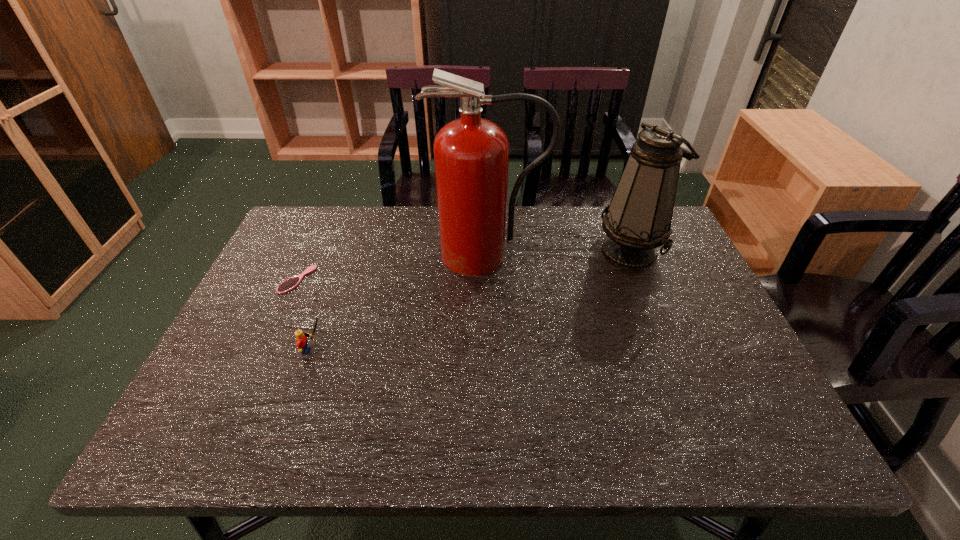
The image size is (960, 540). I want to click on vacant space located on the front-facing side of the Lego, so click(373, 350).

I want to click on free space located on the right of the shortest object, so click(458, 280).

This screenshot has width=960, height=540. In order to click on fire extinguisher present at the far edge in this screenshot , I will do `click(471, 155)`.

You are a GUI agent. You are given a task and a screenshot of the screen. Output one action in this format:
    pyautogui.click(x=<x>, y=<y>)
    Task: Click on the oil lamp positioned at the far edge
    The width and height of the screenshot is (960, 540).
    Given the screenshot: What is the action you would take?
    pyautogui.click(x=638, y=219)

Locate an element on the screen. The image size is (960, 540). object present at the left edge is located at coordinates (289, 284).

Where is `object at the right edge`? Image resolution: width=960 pixels, height=540 pixels. object at the right edge is located at coordinates (638, 219).

You are a GUI agent. You are given a task and a screenshot of the screen. Output one action in this format:
    pyautogui.click(x=<x>, y=<y>)
    Task: Click on the object at the far right corner
    The image size is (960, 540).
    Given the screenshot: What is the action you would take?
    pyautogui.click(x=638, y=219)

Identify the location of free space at the far edge of the desktop. This screenshot has width=960, height=540. (386, 231).

Identify the location of vacant space at the near edge of the desktop. This screenshot has height=540, width=960. (643, 420).

This screenshot has height=540, width=960. In the image, there is a desktop. Identify the location of blank space at the left edge. (195, 404).